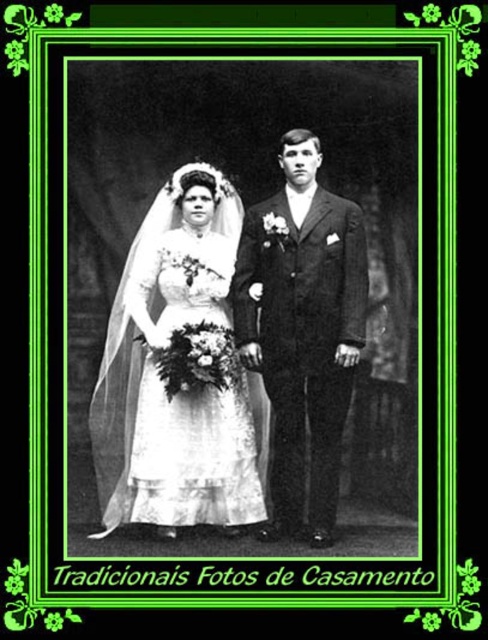
You are a photographer reviewing this black and white photo with a green floral border. You notice the white satin dress at center and the smooth black suit at center. Based on their positions in the image, which clothing item is closer to the bottom edge of the photo?

The white satin dress at center is positioned under the smooth black suit at center, so it is closer to the bottom edge of the photo.

You are a photographer setting up a display for a vintage wedding exhibit. You need to ensure that the white satin dress at center and the smooth black suit at center are both visible in the photo. Given their widths, which one should you position closer to the camera to avoid overlapping?

The white satin dress at center is wider than the smooth black suit at center. To prevent overlapping, position the wider white satin dress at center closer to the camera so it doesn

You are a photographer reviewing this black and white wedding photo with a green floral border. You notice the white satin dress at center and the smooth black suit at center. Which clothing item appears nearer to you in the image?

The white satin dress at center is closer to the viewer than the smooth black suit at center, so the white satin dress at center appears nearer in the image.